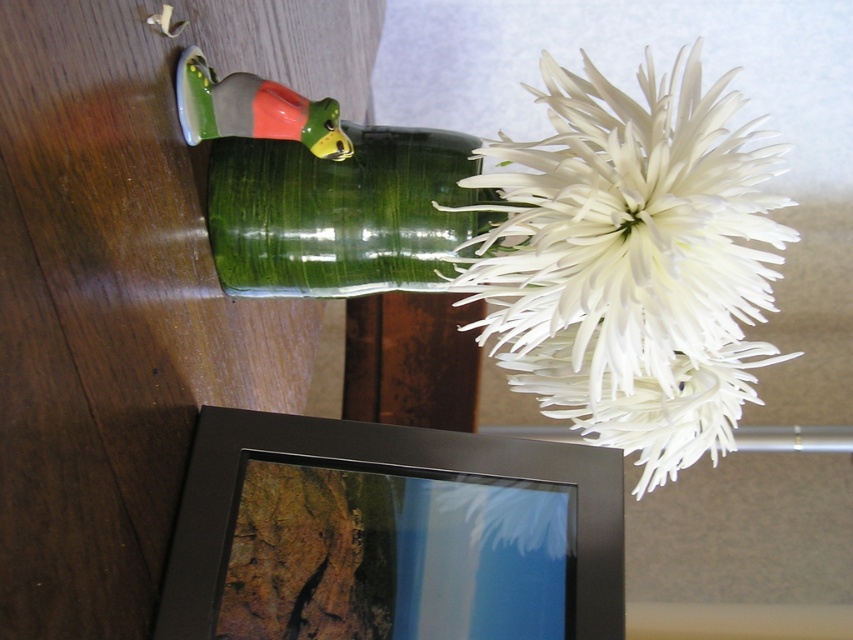
Is white matte flower at upper right to the right of black matte picture frame at lower center from the viewer's perspective?

Correct, you'll find white matte flower at upper right to the right of black matte picture frame at lower center.

At what (x,y) coordinates should I click in order to perform the action: click on white matte flower at upper right. Please return your answer as a coordinate pair (x, y). The width and height of the screenshot is (853, 640). Looking at the image, I should click on (633, 262).

The image size is (853, 640). In order to click on white matte flower at upper right in this screenshot , I will do `click(633, 262)`.

Where is `white matte flower at upper right`? This screenshot has height=640, width=853. white matte flower at upper right is located at coordinates (633, 262).

Is black matte picture frame at lower center wider than green glass vase at upper center?

Yes.

Which is more to the right, black matte picture frame at lower center or green glass vase at upper center?

black matte picture frame at lower center

Which is in front, point (196, 490) or point (329, 209)?

Positioned in front is point (196, 490).

Where is `black matte picture frame at lower center`? The height and width of the screenshot is (640, 853). black matte picture frame at lower center is located at coordinates (392, 532).

Which of these two, white matte flower at upper right or green glass vase at upper center, stands shorter?

With less height is green glass vase at upper center.

From the picture: Who is more forward, (701, 259) or (299, 296)?

Positioned in front is point (701, 259).

Locate an element on the screen. The image size is (853, 640). white matte flower at upper right is located at coordinates (633, 262).